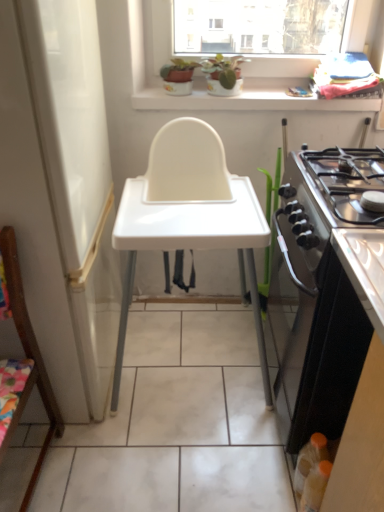
Image resolution: width=384 pixels, height=512 pixels. What are the coordinates of `free space in front of white plastic changing table at center` in the screenshot? It's located at (167, 456).